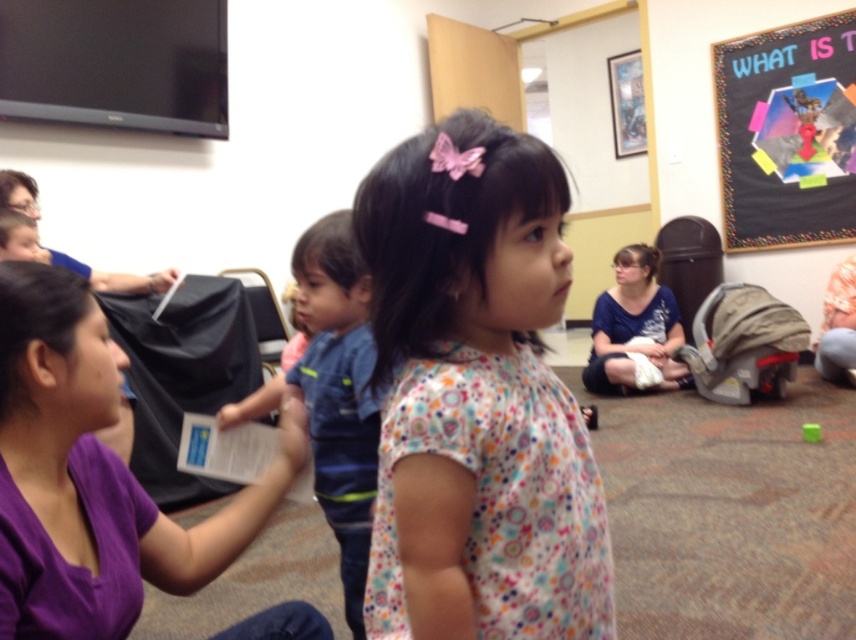
You are standing in the classroom and want to reach both the point at coordinates point (562,445) and point (45,342). Which point should you reach first to minimize the distance walked?

You should reach point (562,445) first because it is closer to the camera, meaning it is nearer to your current position in the classroom.

You are a photographer standing in the classroom scene. You need to take a photo that includes both the black matte poster at upper right and the blue cotton shirt at center. Based on their positions, which object should be placed to the right side in the photo?

The black matte poster at upper right is positioned on the right side of the blue cotton shirt at center, so in the photo, the black matte poster at upper right should be placed to the right side of the blue cotton shirt at center.